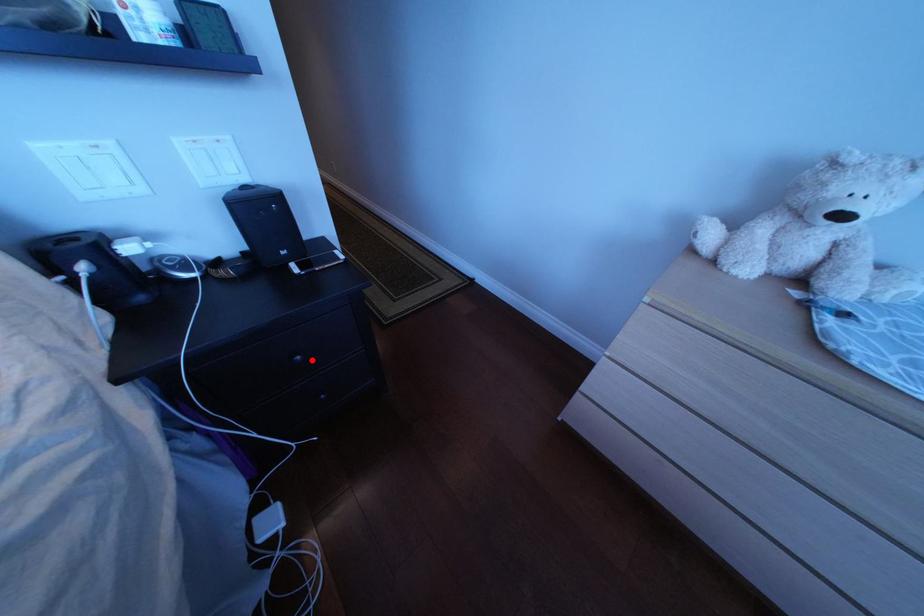
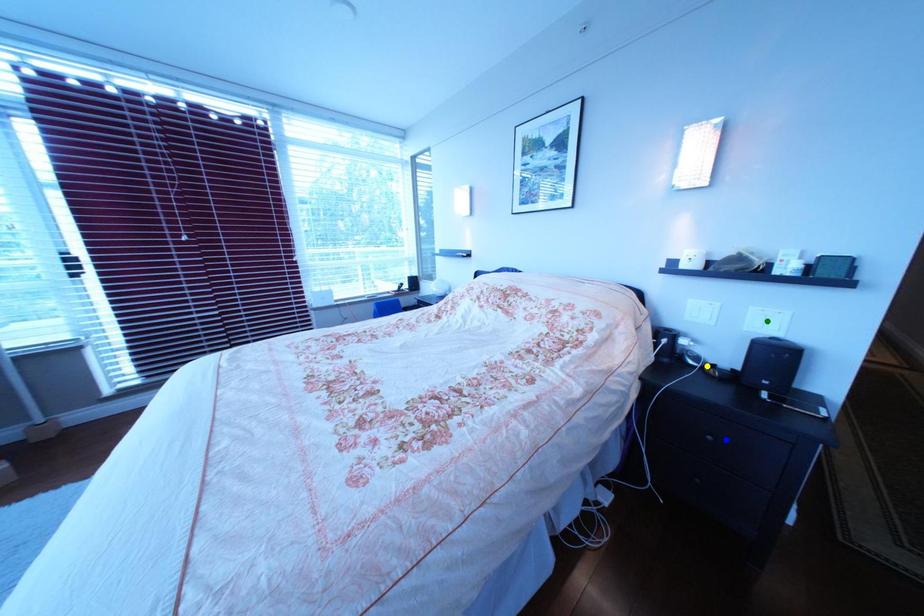
Question: I am providing you with two images of the same scene from different viewpoints. A red point is marked on the first image. You are given multiple points on the second image. In image 2, which mark is for the same physical point as the one in image 1?

Choices:
 (A) blue point
 (B) yellow point
 (C) green point

Answer: (A)